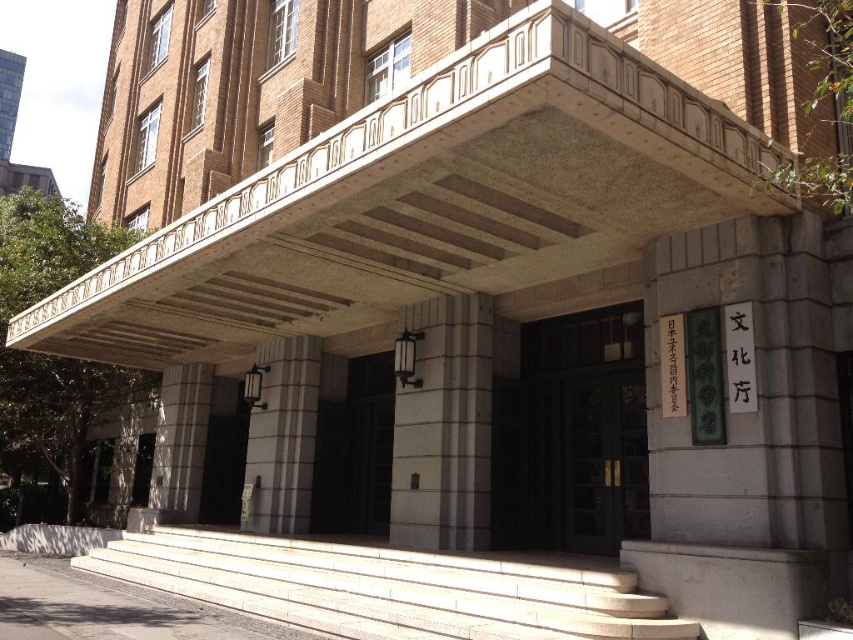
Question: In this image, where is white stone pillar at center located relative to white stone column at center?

Choices:
 (A) below
 (B) above

Answer: (B)

Question: Does white stone stairs at center appear on the left side of white stone column at center?

Choices:
 (A) no
 (B) yes

Answer: (A)

Question: Which object is farther from the camera taking this photo?

Choices:
 (A) white stone column at center
 (B) white stone pillar at center
 (C) white stone stairs at center

Answer: (A)

Question: Which point is farther from the camera taking this photo?

Choices:
 (A) (267, 596)
 (B) (274, 513)

Answer: (B)

Question: Which is nearer to the white stone column at center?

Choices:
 (A) white stone pillar at center
 (B) white stone stairs at center

Answer: (B)

Question: Is white stone stairs at center wider than white stone pillar at center?

Choices:
 (A) no
 (B) yes

Answer: (B)